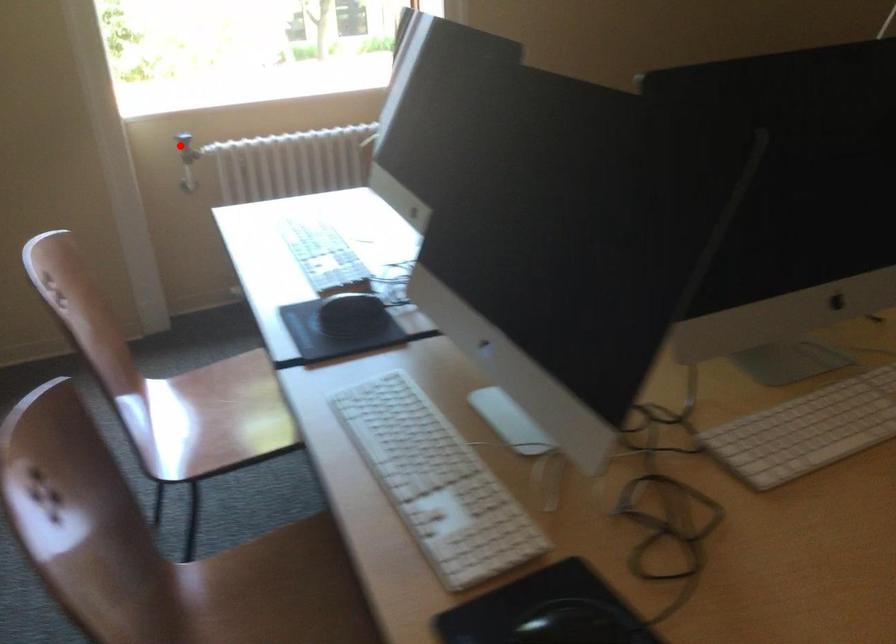
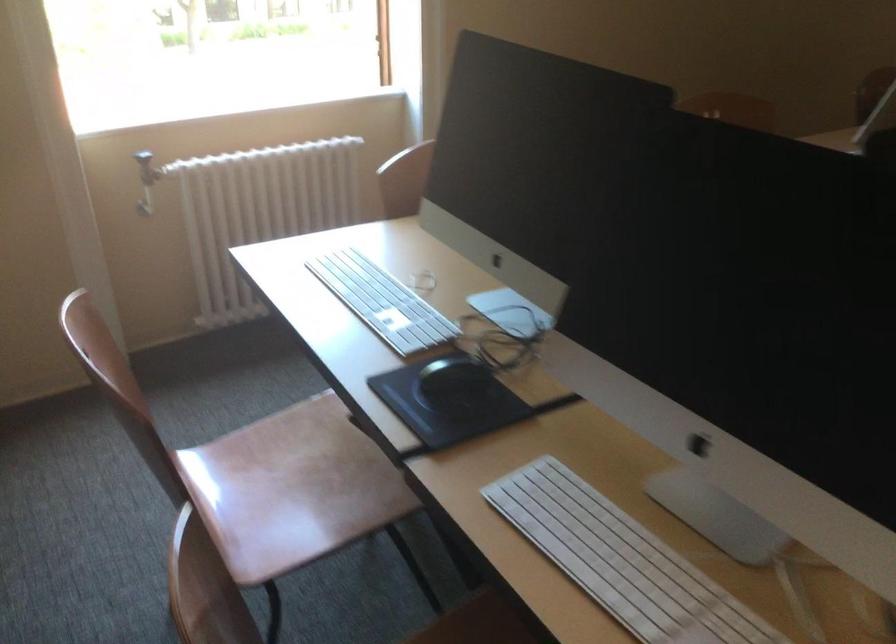
Question: I am providing you with two images of the same scene from different viewpoints. Image1 has a red point marked. In image2, the corresponding 3D location appears at what relative position? Reply with the corresponding letter.

Choices:
 (A) Closer
 (B) Farther

Answer: (A)